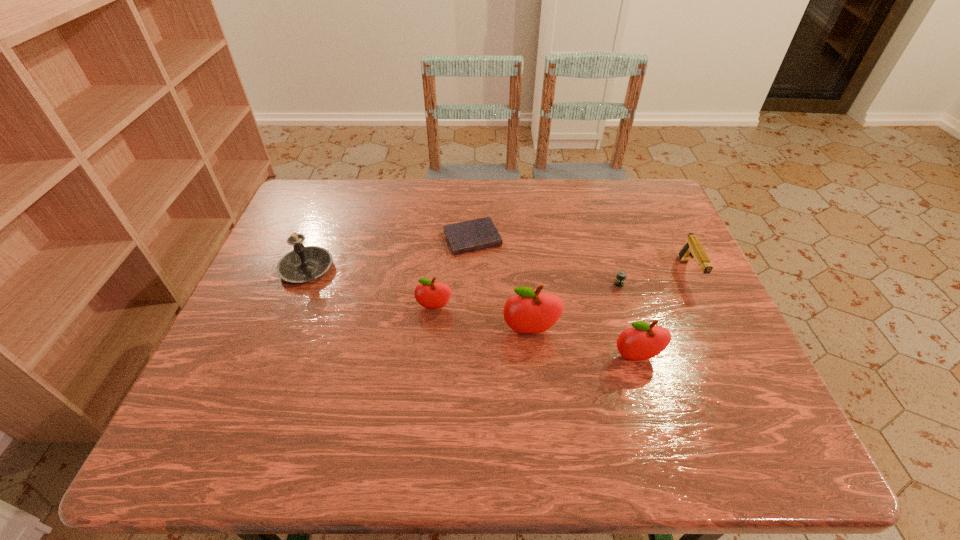
Find the location of a particular element. This screenshot has width=960, height=540. free region at the far edge of the desktop is located at coordinates (453, 188).

At what (x,y) coordinates should I click in order to perform the action: click on free region at the near edge of the desktop. Please return your answer as a coordinate pair (x, y). This screenshot has width=960, height=540. Looking at the image, I should click on (477, 404).

What are the coordinates of `free space at the left edge of the desktop` in the screenshot? It's located at (326, 244).

In the image, there is a desktop. Identify the location of vacant space at the right edge. The width and height of the screenshot is (960, 540). (696, 314).

The height and width of the screenshot is (540, 960). In the image, there is a desktop. What are the coordinates of `vacant space at the far left corner` in the screenshot? It's located at (315, 180).

Locate an element on the screen. The width and height of the screenshot is (960, 540). free region at the near left corner of the desktop is located at coordinates (224, 377).

The height and width of the screenshot is (540, 960). Identify the location of free space at the far right corner of the desktop. (658, 191).

Identify the location of vacant space at the near right corner of the desktop. Image resolution: width=960 pixels, height=540 pixels. (685, 378).

I want to click on free space between the leftmost object and the second shortest object, so click(463, 276).

This screenshot has width=960, height=540. I want to click on free area in between the pistol and the leftmost object, so click(x=497, y=271).